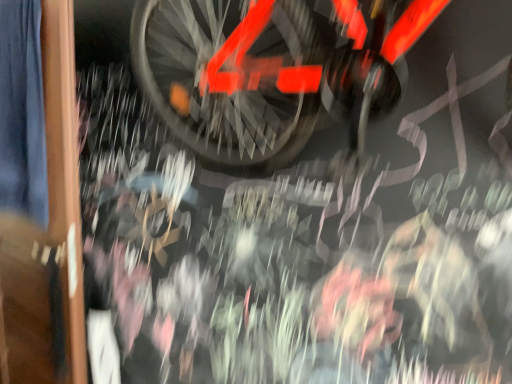
Describe the element at coordinates (39, 195) in the screenshot. I see `wooden door at left` at that location.

Locate an element on the screen. wooden door at left is located at coordinates (39, 195).

Find the location of a particular element. wooden door at left is located at coordinates (39, 195).